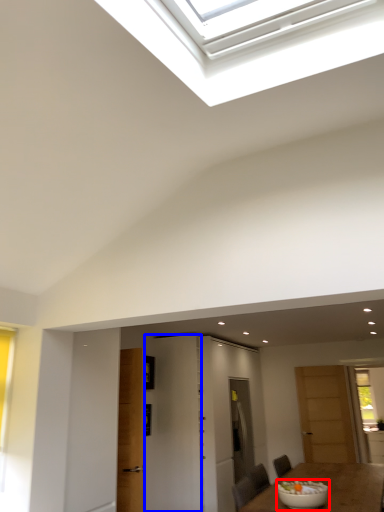
Question: Which object is closer to the camera taking this photo, bowl (highlighted by a red box) or door (highlighted by a blue box)?

Choices:
 (A) bowl
 (B) door

Answer: (A)